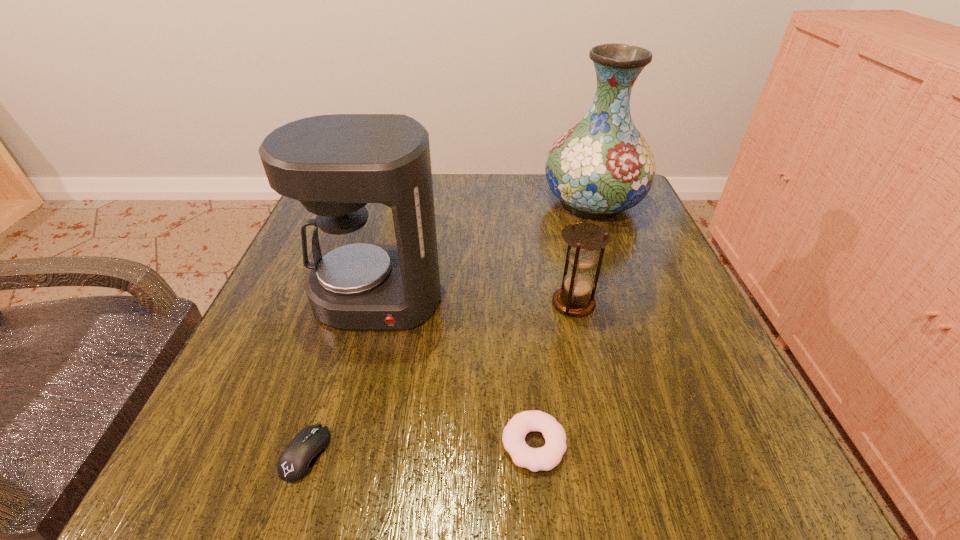
At what (x,y) coordinates should I click in order to perform the action: click on vacant space that is in between the computer equipment and the third object from left to right. Please return your answer as a coordinate pair (x, y). The image size is (960, 540). Looking at the image, I should click on (420, 449).

Where is `vacant space in between the third object from right to left and the computer equipment`? The height and width of the screenshot is (540, 960). vacant space in between the third object from right to left and the computer equipment is located at coordinates (420, 449).

The image size is (960, 540). In order to click on vacant space that's between the farthest object and the doughnut in this screenshot , I will do `click(564, 324)`.

Find the location of a particular element. object that can be found as the fourth closest to the third object from right to left is located at coordinates (603, 165).

Select which object is the second closest to the third shortest object. Please provide its 2D coordinates. Your answer should be formatted as a tuple, i.e. [(x, y)], where the tuple contains the x and y coordinates of a point satisfying the conditions above.

[(545, 458)]

Find the location of a particular element. This screenshot has height=540, width=960. free space in the image that satisfies the following two spatial constraints: 1. on the button side of the third shortest object; 2. on the left side of the coffee maker is located at coordinates (375, 303).

The width and height of the screenshot is (960, 540). In order to click on vacant space that satisfies the following two spatial constraints: 1. on the button side of the coffee maker; 2. on the right side of the hourglass in this screenshot , I will do `click(375, 303)`.

Where is `vacant point that satisfies the following two spatial constraints: 1. on the back side of the third shortest object; 2. on the right side of the farthest object`? vacant point that satisfies the following two spatial constraints: 1. on the back side of the third shortest object; 2. on the right side of the farthest object is located at coordinates (551, 204).